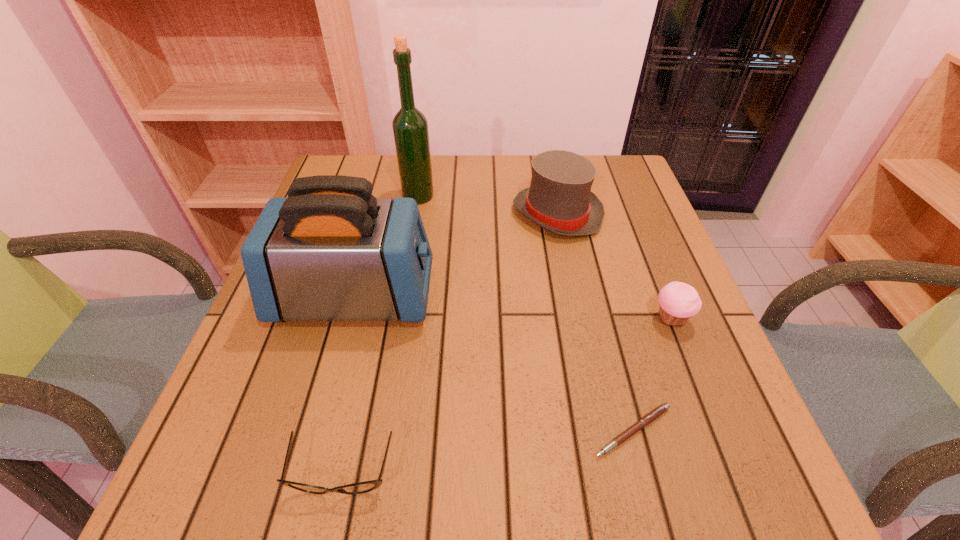
I want to click on vacant space that satisfies the following two spatial constraints: 1. on the front side of the dress hat; 2. on the right side of the rightmost object, so [x=579, y=319].

Where is `free spot that satisfies the following two spatial constraints: 1. on the front side of the dress hat; 2. on the front-facing side of the second tallest object`? This screenshot has height=540, width=960. free spot that satisfies the following two spatial constraints: 1. on the front side of the dress hat; 2. on the front-facing side of the second tallest object is located at coordinates (574, 297).